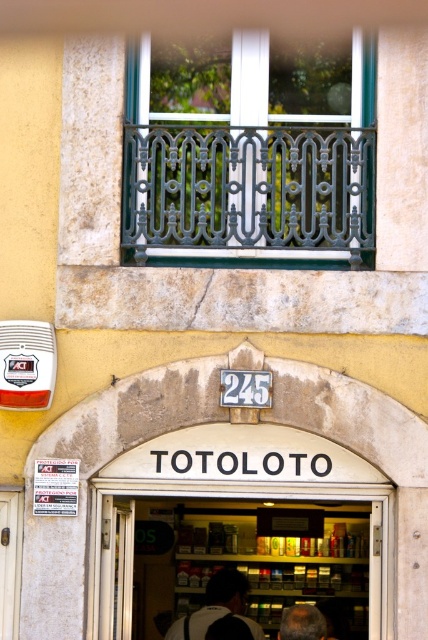
Question: Which object is farther from the camera taking this photo?

Choices:
 (A) dark gray backpack at center
 (B) gray hair at lower center
 (C) metallic glass door at center

Answer: (C)

Question: Can you confirm if metallic glass door at center is thinner than dark gray backpack at center?

Choices:
 (A) no
 (B) yes

Answer: (A)

Question: Can you confirm if metallic glass door at center is wider than dark gray backpack at center?

Choices:
 (A) yes
 (B) no

Answer: (A)

Question: Which point is closer to the camera?

Choices:
 (A) metallic glass door at center
 (B) gray hair at lower center

Answer: (B)

Question: Can you confirm if wooden door at lower left is positioned to the left of dark gray backpack at center?

Choices:
 (A) yes
 (B) no

Answer: (A)

Question: Which point is closer to the camera?

Choices:
 (A) (21, 538)
 (B) (253, 625)
 (C) (318, 630)
 (D) (284, 522)

Answer: (A)